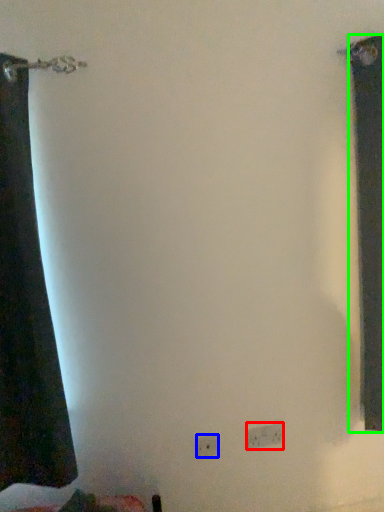
Question: Considering the real-world distances, which object is closest to electric outlet (highlighted by a red box)? electric outlet (highlighted by a blue box) or curtain (highlighted by a green box).

Choices:
 (A) electric outlet
 (B) curtain

Answer: (A)